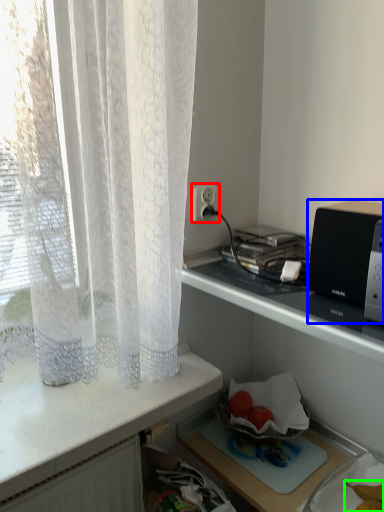
Question: Which is farther away from electric outlet (highlighted by a red box)? appliance (highlighted by a blue box) or food (highlighted by a green box)?

Choices:
 (A) appliance
 (B) food

Answer: (B)